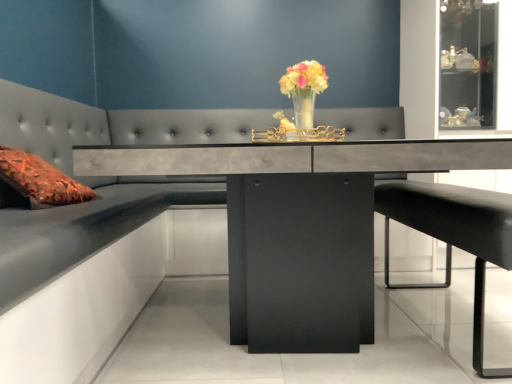
Question: Does translucent glass vase at center have a lesser width compared to black leather bar stool at lower right?

Choices:
 (A) yes
 (B) no

Answer: (A)

Question: Can you confirm if translucent glass vase at center is shorter than black leather bar stool at lower right?

Choices:
 (A) yes
 (B) no

Answer: (A)

Question: From a real-world perspective, is translucent glass vase at center located beneath black leather bar stool at lower right?

Choices:
 (A) no
 (B) yes

Answer: (A)

Question: From the image's perspective, does translucent glass vase at center appear lower than black leather bar stool at lower right?

Choices:
 (A) no
 (B) yes

Answer: (A)

Question: Considering the relative sizes of translucent glass vase at center and black leather bar stool at lower right in the image provided, is translucent glass vase at center wider than black leather bar stool at lower right?

Choices:
 (A) no
 (B) yes

Answer: (A)

Question: Is black leather bar stool at lower right situated inside translucent glass vase at center or outside?

Choices:
 (A) inside
 (B) outside

Answer: (B)

Question: Relative to translucent glass vase at center, is black leather bar stool at lower right in front or behind?

Choices:
 (A) behind
 (B) front

Answer: (B)

Question: Considering the positions of black leather bar stool at lower right and translucent glass vase at center in the image, is black leather bar stool at lower right bigger or smaller than translucent glass vase at center?

Choices:
 (A) small
 (B) big

Answer: (B)

Question: From the image's perspective, is black leather bar stool at lower right above or below translucent glass vase at center?

Choices:
 (A) below
 (B) above

Answer: (A)

Question: In terms of size, does translucent glass vase at center appear bigger or smaller than black leather bar stool at lower right?

Choices:
 (A) small
 (B) big

Answer: (A)

Question: Is point (307, 89) closer or farther from the camera than point (479, 354)?

Choices:
 (A) farther
 (B) closer

Answer: (A)

Question: In the image, is translucent glass vase at center on the left side or the right side of black leather bar stool at lower right?

Choices:
 (A) right
 (B) left

Answer: (B)

Question: Relative to black leather bar stool at lower right, is translucent glass vase at center in front or behind?

Choices:
 (A) behind
 (B) front

Answer: (A)

Question: Is concrete gray table at center wider or thinner than translucent glass vase at center?

Choices:
 (A) thin
 (B) wide

Answer: (B)

Question: Relative to translucent glass vase at center, is concrete gray table at center in front or behind?

Choices:
 (A) behind
 (B) front

Answer: (B)